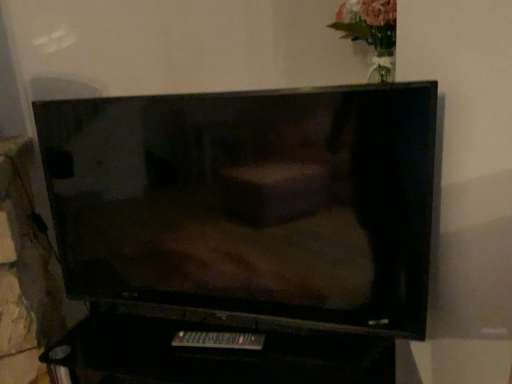
Question: Is matte black tv at center taller or shorter than black plastic remote at lower center?

Choices:
 (A) tall
 (B) short

Answer: (A)

Question: From a real-world perspective, is matte black tv at center above or below black plastic remote at lower center?

Choices:
 (A) above
 (B) below

Answer: (A)

Question: Is matte black tv at center spatially inside black plastic remote at lower center, or outside of it?

Choices:
 (A) outside
 (B) inside

Answer: (A)

Question: From the image's perspective, relative to matte black tv at center, is black plastic remote at lower center above or below?

Choices:
 (A) above
 (B) below

Answer: (B)

Question: Is black plastic remote at lower center taller or shorter than matte black tv at center?

Choices:
 (A) tall
 (B) short

Answer: (B)

Question: Does point (239, 339) appear closer or farther from the camera than point (379, 233)?

Choices:
 (A) farther
 (B) closer

Answer: (A)

Question: Which is correct: black plastic remote at lower center is inside matte black tv at center, or outside of it?

Choices:
 (A) inside
 (B) outside

Answer: (B)